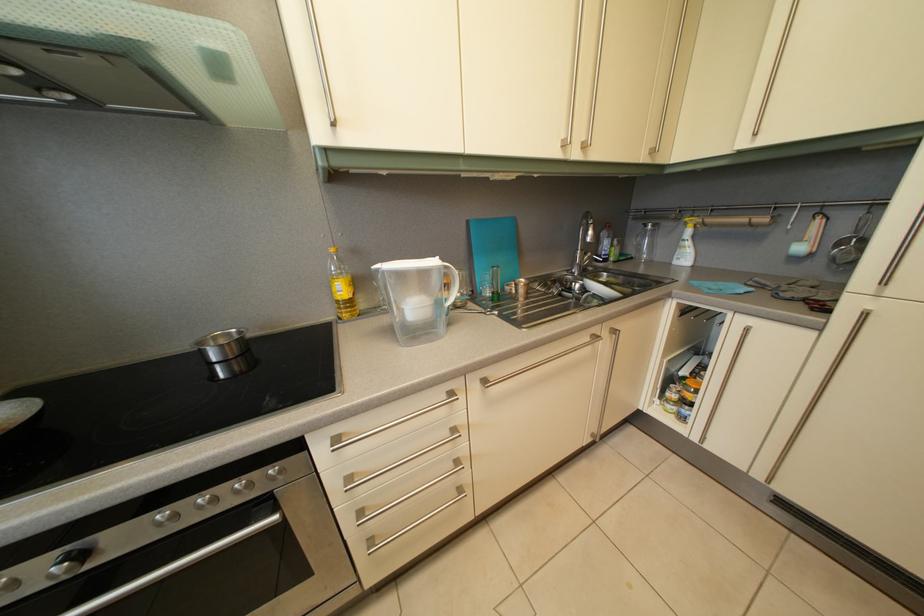
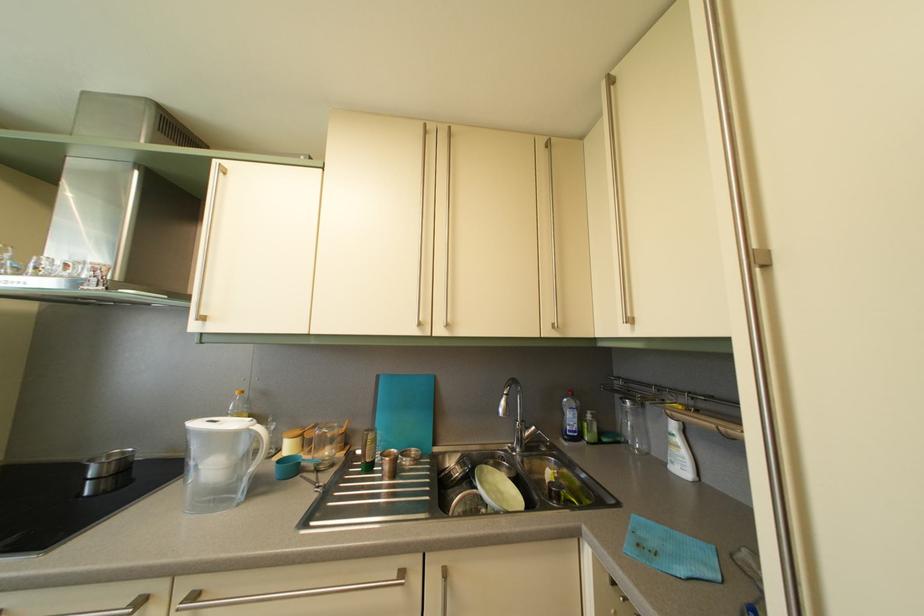
Find the pixel in the second image that matches (224,346) in the first image.

(118, 463)